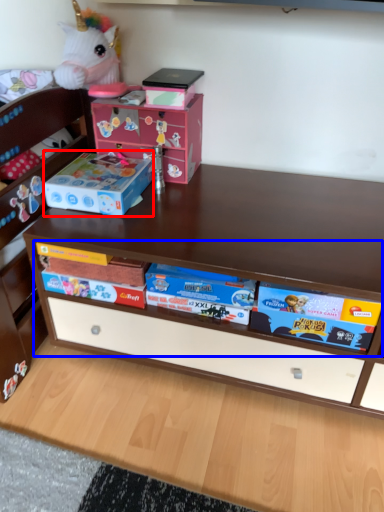
Question: Which object is closer to the camera taking this photo, storage box (highlighted by a red box) or book (highlighted by a blue box)?

Choices:
 (A) storage box
 (B) book

Answer: (B)